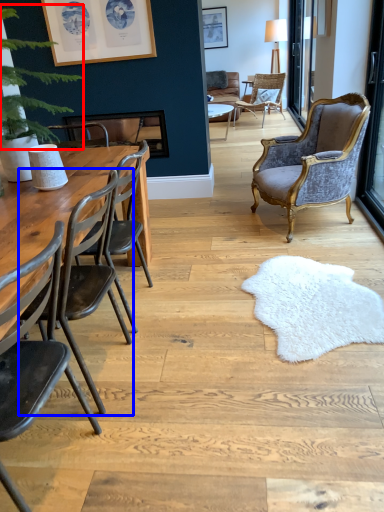
Question: Which of the following is the closest to the observer, plant (highlighted by a red box) or chair (highlighted by a blue box)?

Choices:
 (A) plant
 (B) chair

Answer: (B)